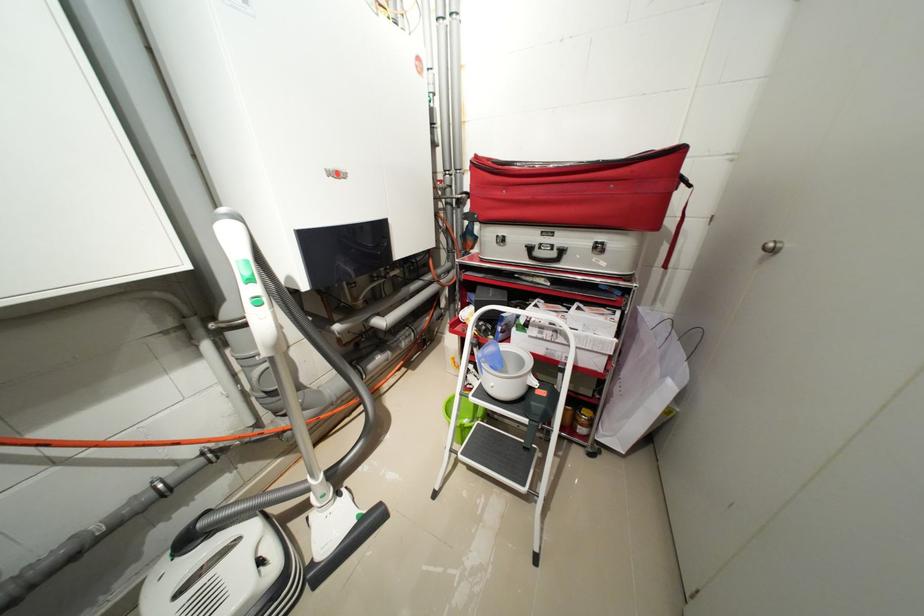
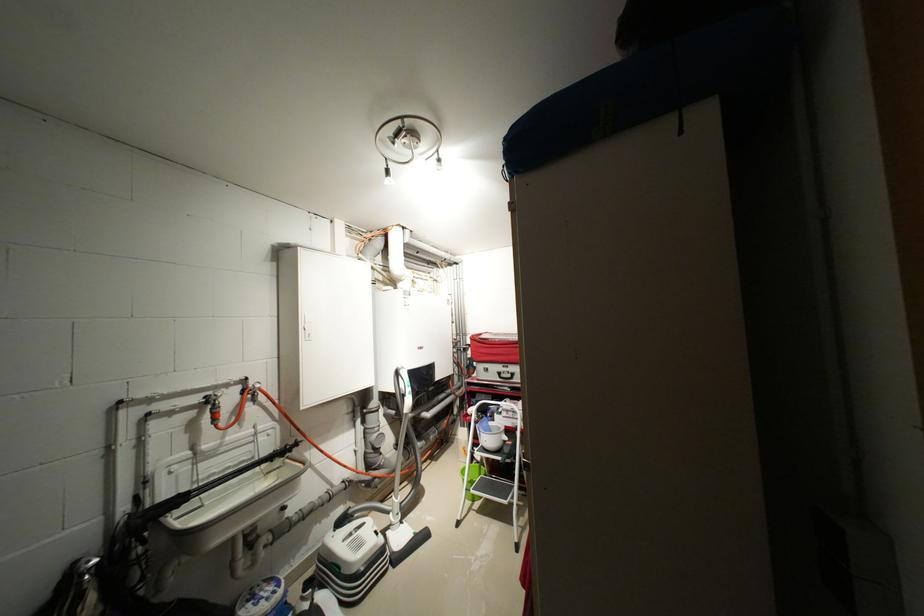
The point at (480, 346) is marked in the first image. Where is the corresponding point in the second image?

(482, 424)